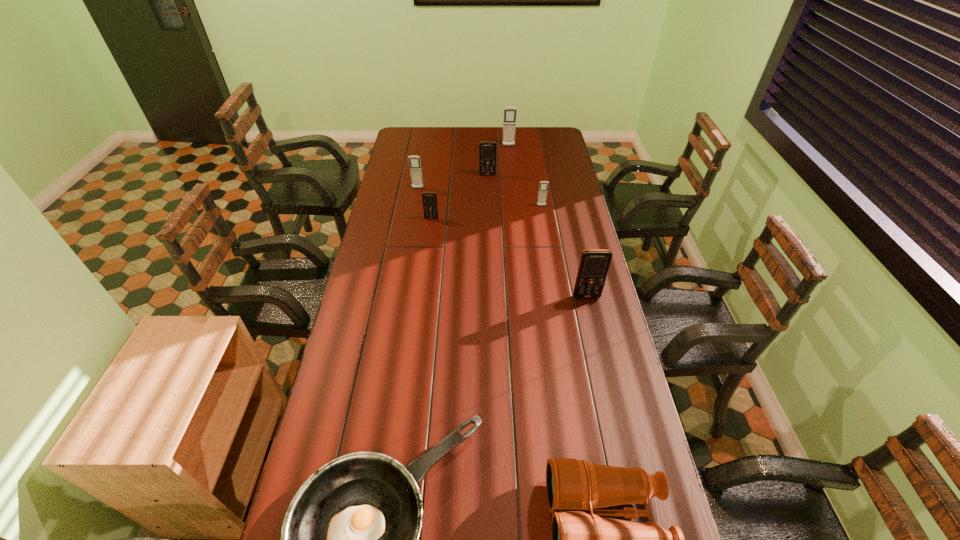
Image resolution: width=960 pixels, height=540 pixels. I want to click on vacant space at the far edge of the desktop, so click(478, 146).

Where is `free space at the left edge of the desktop`? This screenshot has height=540, width=960. free space at the left edge of the desktop is located at coordinates (322, 448).

In the image, there is a desktop. Identify the location of vacant space at the right edge. Image resolution: width=960 pixels, height=540 pixels. (583, 225).

Where is `free space at the far right corner of the desktop`? free space at the far right corner of the desktop is located at coordinates (551, 136).

Image resolution: width=960 pixels, height=540 pixels. Find the location of `empty space that is in between the second smallest orange cellular telephone and the leftmost gray cellular telephone`. empty space that is in between the second smallest orange cellular telephone and the leftmost gray cellular telephone is located at coordinates (452, 182).

The height and width of the screenshot is (540, 960). I want to click on free space between the second orange cellular telephone from left to right and the second farthest orange cellular telephone, so click(460, 197).

The width and height of the screenshot is (960, 540). Identify the location of vacant area between the second farthest cellular telephone and the leftmost cellular telephone. (452, 182).

The height and width of the screenshot is (540, 960). In order to click on free space that is in between the farthest cellular telephone and the fourth nearest cellular telephone in this screenshot , I will do `click(463, 167)`.

The height and width of the screenshot is (540, 960). Find the location of `the closest object to the binoculars`. the closest object to the binoculars is located at coordinates (350, 538).

Where is `object that is the third closest to the third nearest object`? The image size is (960, 540). object that is the third closest to the third nearest object is located at coordinates (579, 539).